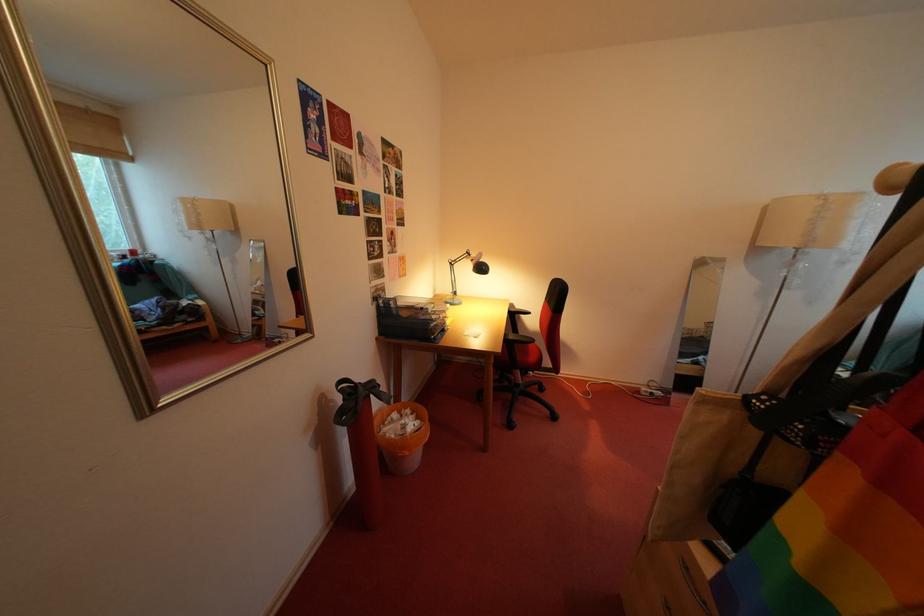
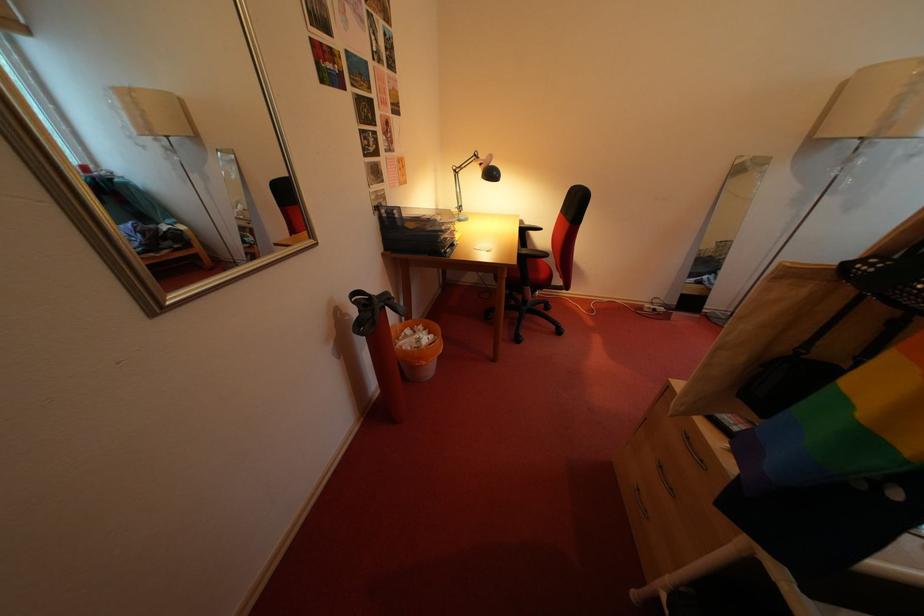
In the second image, find the point that corresponds to (x=421, y=419) in the first image.

(434, 334)